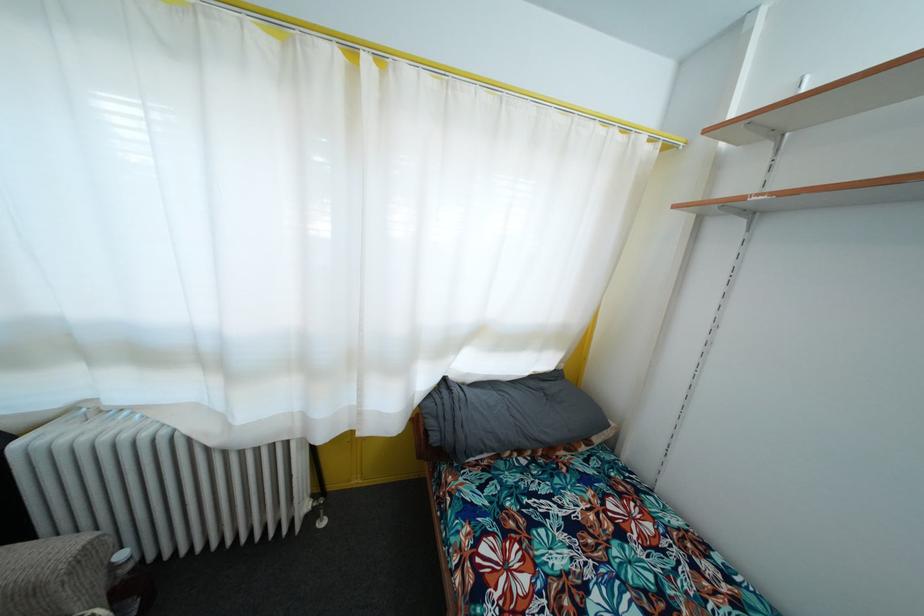
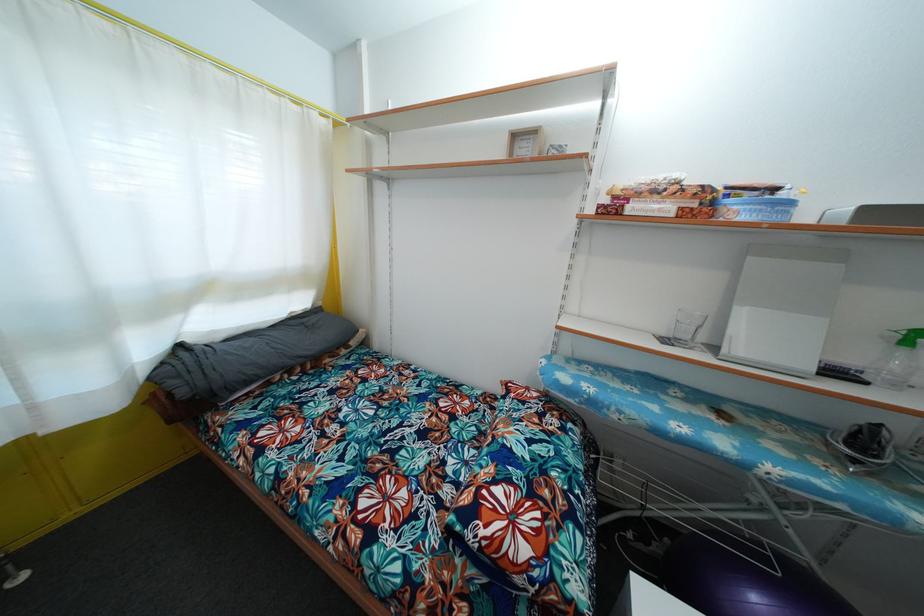
Find the pixel in the second image that matches [439,445] in the first image.

(187, 399)